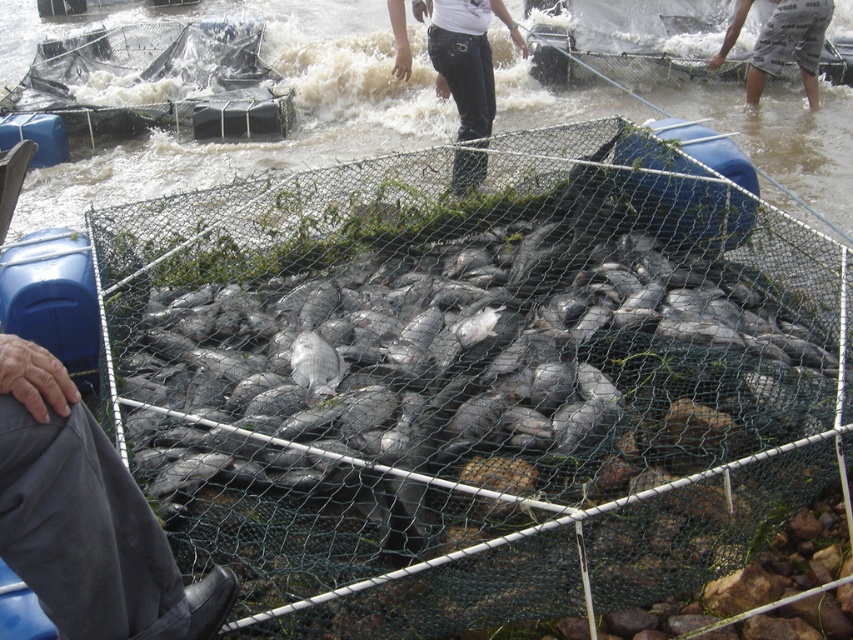
Question: Among these points, which one is farthest from the camera?

Choices:
 (A) (76, 624)
 (B) (662, 355)
 (C) (805, 3)

Answer: (C)

Question: Which point is closer to the camera?

Choices:
 (A) gray cotton shorts at upper right
 (B) black denim pants at upper center

Answer: (B)

Question: Is the position of black denim pants at upper center less distant than that of gray matte fish at center?

Choices:
 (A) no
 (B) yes

Answer: (A)

Question: Is gray fabric pants at lower left to the right of gray matte fish at center from the viewer's perspective?

Choices:
 (A) no
 (B) yes

Answer: (A)

Question: Is gray fabric pants at lower left positioned at the back of gray cotton shorts at upper right?

Choices:
 (A) no
 (B) yes

Answer: (A)

Question: Which object is farther from the camera taking this photo?

Choices:
 (A) gray cotton shorts at upper right
 (B) silvery metallic fish at center

Answer: (A)